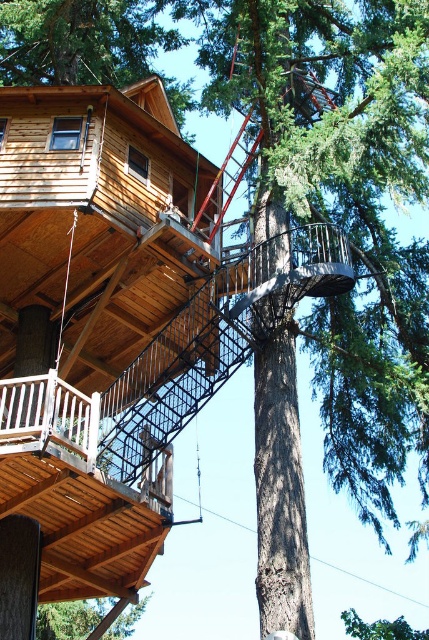
Consider the image. You are a bird flying towards the green wood tree at lower left and the green leafy tree at upper center. Which tree will you reach first if you fly straight from your current position?

The green wood tree at lower left will be reached first because it is positioned above the green leafy tree at upper center, meaning it is closer to your flight path.

You are planning to hang a large bird feeder from one of the trees in the treehouse area. Which tree, the green wood tree at lower left or the green leafy tree at upper center, would be more suitable based on their thickness?

→ The green leafy tree at upper center is thicker than the green wood tree at lower left, making it more suitable for hanging a large bird feeder due to its sturdier structure.